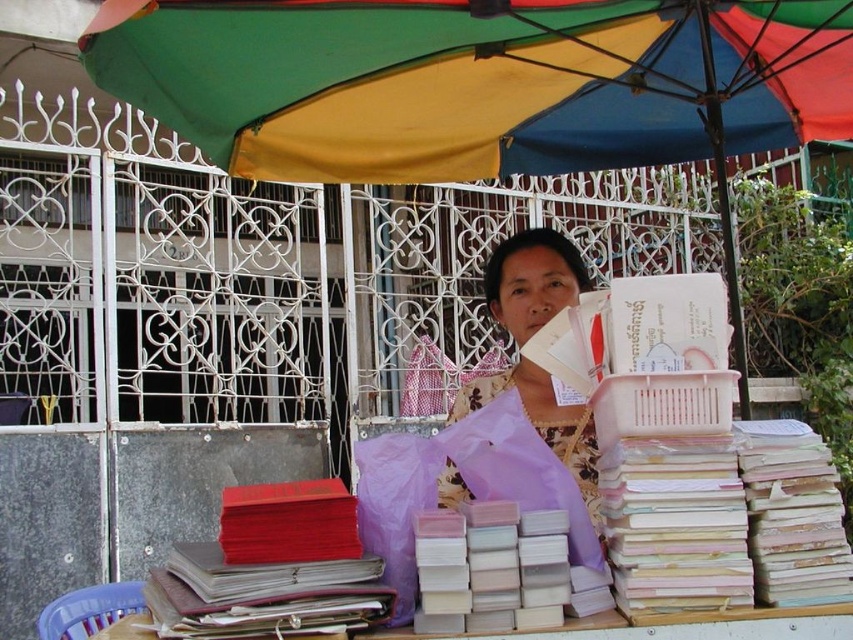
Question: From the image, what is the correct spatial relationship of multicolored fabric umbrella at upper center in relation to white matte book at center?

Choices:
 (A) right
 (B) left

Answer: (A)

Question: Does red leather book at left have a lesser width compared to white matte book at center?

Choices:
 (A) no
 (B) yes

Answer: (A)

Question: Among these objects, which one is farthest from the camera?

Choices:
 (A) wooden table at lower center
 (B) pastel paper stack at center
 (C) matte purple blouse at center

Answer: (C)

Question: Is the position of red leather book at left more distant than that of white matte book at center?

Choices:
 (A) yes
 (B) no

Answer: (B)

Question: Which object is closer to the camera taking this photo?

Choices:
 (A) white matte book at center
 (B) matte purple blouse at center
 (C) pastel paper stack at center
 (D) multicolored fabric umbrella at upper center

Answer: (A)

Question: Estimate the real-world distances between objects in this image. Which object is closer to the pastel paper stack at center?

Choices:
 (A) red leather book at left
 (B) wooden table at lower center

Answer: (B)